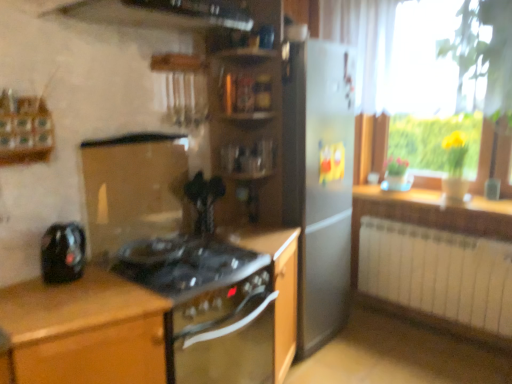
Question: Can you confirm if wooden shelves at center is bigger than yellow glass vase at right?

Choices:
 (A) yes
 (B) no

Answer: (A)

Question: From a real-world perspective, is wooden shelves at center positioned over yellow glass vase at right based on gravity?

Choices:
 (A) yes
 (B) no

Answer: (A)

Question: Does wooden shelves at center come behind yellow glass vase at right?

Choices:
 (A) yes
 (B) no

Answer: (B)

Question: From a real-world perspective, is wooden shelves at center located beneath yellow glass vase at right?

Choices:
 (A) no
 (B) yes

Answer: (A)

Question: Does wooden shelves at center have a smaller size compared to yellow glass vase at right?

Choices:
 (A) no
 (B) yes

Answer: (A)

Question: Is wooden shelves at center looking in the opposite direction of yellow glass vase at right?

Choices:
 (A) no
 (B) yes

Answer: (A)

Question: Is black glass stove at center, placed as the second cabinetry when sorted from right to left, aimed at wooden shelves at center?

Choices:
 (A) no
 (B) yes

Answer: (A)

Question: From a real-world perspective, is black glass stove at center, which is the 2th cabinetry from left to right, positioned under wooden shelves at center based on gravity?

Choices:
 (A) yes
 (B) no

Answer: (A)

Question: Is black glass stove at center, which is the 2th cabinetry from left to right, facing away from wooden shelves at center?

Choices:
 (A) no
 (B) yes

Answer: (A)

Question: Does black glass stove at center, placed as the second cabinetry when sorted from right to left, have a greater height compared to wooden shelves at center?

Choices:
 (A) yes
 (B) no

Answer: (B)

Question: Considering the relative sizes of black glass stove at center, which is the 2th cabinetry from left to right, and wooden shelves at center in the image provided, is black glass stove at center, which is the 2th cabinetry from left to right, wider than wooden shelves at center?

Choices:
 (A) no
 (B) yes

Answer: (B)

Question: Does black glass stove at center, which is the 2th cabinetry from left to right, appear on the left side of wooden shelves at center?

Choices:
 (A) yes
 (B) no

Answer: (A)

Question: Is black glass gas stove at center further to camera compared to wooden countertop at right?

Choices:
 (A) yes
 (B) no

Answer: (B)